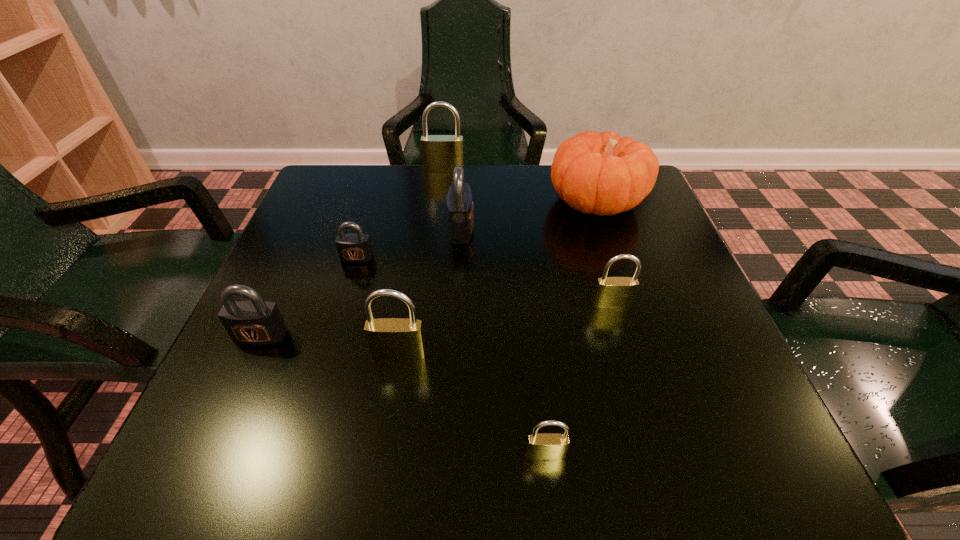
What are the coordinates of `the rightmost brass padlock` in the screenshot? It's located at pyautogui.click(x=611, y=292).

The image size is (960, 540). What are the coordinates of `the sixth padlock from right to left` in the screenshot? It's located at (354, 248).

Locate an element on the screen. This screenshot has height=540, width=960. the smallest gray padlock is located at coordinates (354, 248).

Locate an element on the screen. This screenshot has width=960, height=540. the nearest brass padlock is located at coordinates (546, 446).

This screenshot has height=540, width=960. What are the coordinates of `the nearest padlock` in the screenshot? It's located at click(546, 446).

I want to click on blank space located 0.250m on the front-facing side of the farthest object, so click(x=437, y=233).

Identify the location of free space located on the left of the pumpkin. (522, 202).

You are a GUI agent. You are given a task and a screenshot of the screen. Output one action in this format:
    pyautogui.click(x=<x>, y=<y>)
    Task: Click on the vacant region located 0.150m on the front of the rightmost gray padlock near the keyhole
    The width and height of the screenshot is (960, 540).
    Given the screenshot: What is the action you would take?
    pyautogui.click(x=541, y=229)

Find the location of a particular element. This screenshot has width=960, height=540. vacant space located on the front-facing side of the sixth farthest padlock is located at coordinates (389, 417).

Locate an element on the screen. vacant space situated 0.200m on the front of the second biggest gray padlock near the keyhole is located at coordinates (203, 465).